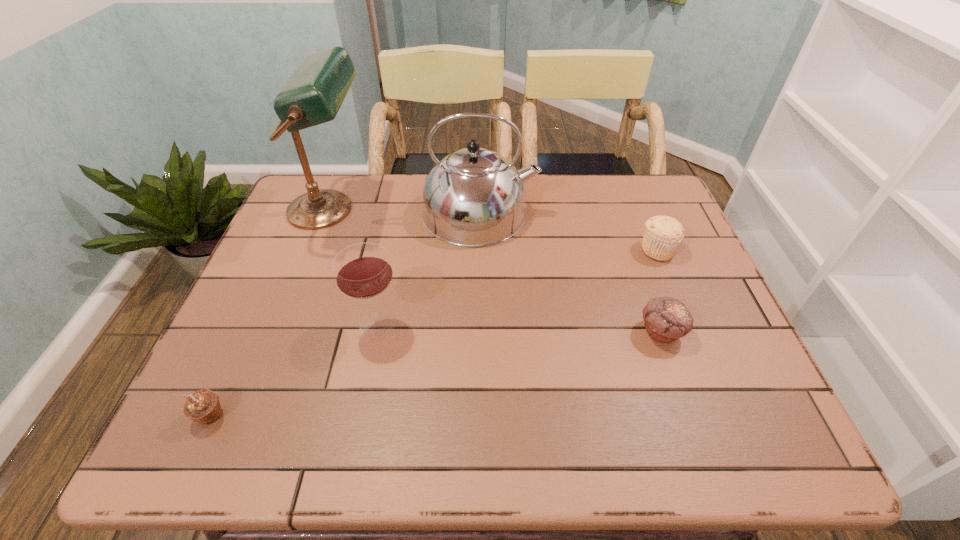
This screenshot has height=540, width=960. I want to click on free location located from the spout of the third object from right to left, so click(554, 212).

Where is `vacant area situated on the right of the wineglass`? This screenshot has height=540, width=960. vacant area situated on the right of the wineglass is located at coordinates (519, 325).

What are the coordinates of `vacant space positioned on the front of the farthest muffin` in the screenshot? It's located at (692, 334).

Where is `free space located on the back of the second nearest muffin`? free space located on the back of the second nearest muffin is located at coordinates (621, 218).

Where is `free space located on the right of the leftmost muffin`? free space located on the right of the leftmost muffin is located at coordinates (313, 416).

Find the location of a particular element. This screenshot has height=540, width=960. table lamp situated at the far edge is located at coordinates (314, 93).

Identify the location of kettle located in the far edge section of the desktop. (473, 197).

The height and width of the screenshot is (540, 960). In order to click on object situated at the near edge in this screenshot , I will do `click(203, 406)`.

Find the location of a particular element. table lamp that is positioned at the left edge is located at coordinates (314, 93).

Locate an element on the screen. Image resolution: width=960 pixels, height=540 pixels. muffin at the left edge is located at coordinates (203, 406).